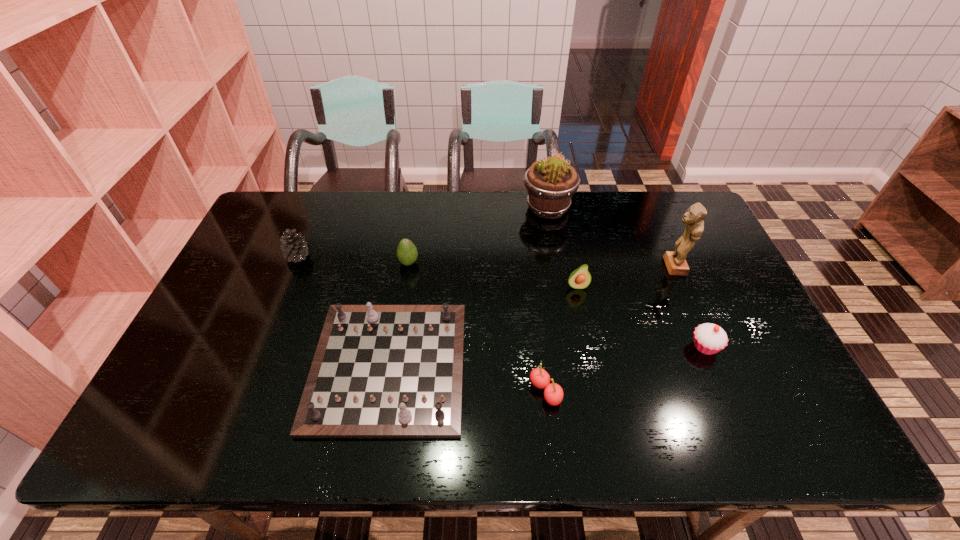
Where is `free spot located on the front-facing side of the figurine`? This screenshot has width=960, height=540. free spot located on the front-facing side of the figurine is located at coordinates (620, 266).

The width and height of the screenshot is (960, 540). What are the coordinates of `free location located on the front-facing side of the figurine` in the screenshot? It's located at (616, 266).

Find the location of a particular element. The image size is (960, 540). vacant space positioned 0.140m on the front-facing side of the figurine is located at coordinates (616, 266).

Locate an element on the screen. free space located 0.170m on the back of the pinecone is located at coordinates (315, 214).

The height and width of the screenshot is (540, 960). Find the location of `free space located on the cut side of the fourth nearest object`. free space located on the cut side of the fourth nearest object is located at coordinates (593, 362).

The width and height of the screenshot is (960, 540). I want to click on blank space located 0.290m on the left of the farther avocado, so [304, 263].

This screenshot has height=540, width=960. In order to click on free space located 0.270m on the back of the cupcake in this screenshot , I will do `click(669, 264)`.

Identify the location of free space located on the right of the cherry. (599, 392).

This screenshot has width=960, height=540. I want to click on object located in the far edge section of the desktop, so click(551, 183).

Identify the location of object present at the near edge. The height and width of the screenshot is (540, 960). (379, 371).